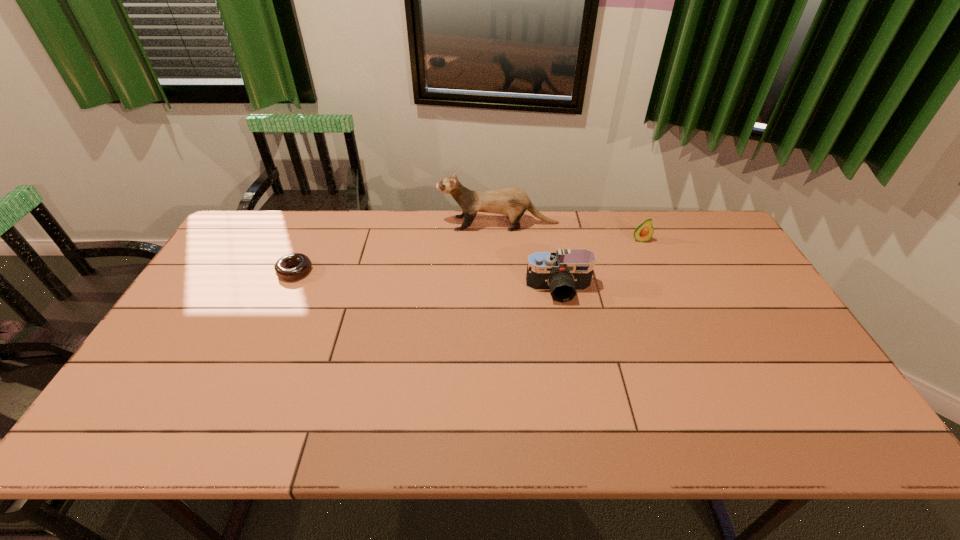
The image size is (960, 540). Find the location of `the tallest object`. the tallest object is located at coordinates (513, 202).

Find the location of a particular element. The width and height of the screenshot is (960, 540). the farthest object is located at coordinates (513, 202).

The height and width of the screenshot is (540, 960). What are the coordinates of `camera` in the screenshot? It's located at (563, 272).

This screenshot has width=960, height=540. Identify the location of the second shortest object. (644, 232).

What are the coordinates of `the rightmost object` in the screenshot? It's located at (644, 232).

Identify the location of doughnut. pyautogui.click(x=303, y=263).

Find the location of a particular element. The height and width of the screenshot is (540, 960). the shortest object is located at coordinates (303, 263).

Identify the location of vacant space situated on the face of the farthest object. This screenshot has width=960, height=540. (370, 224).

Locate an element on the screen. The height and width of the screenshot is (540, 960). vacant region located on the face of the farthest object is located at coordinates (390, 224).

Find the location of a particular element. free space located 0.190m on the face of the farthest object is located at coordinates (384, 224).